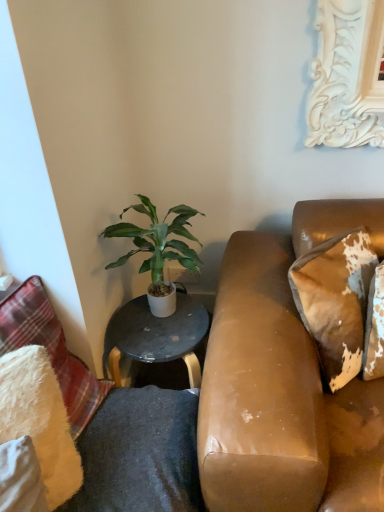
Question: Is the surface of leather-like brown pillow at right, placed as the third pillow when sorted from left to right, in direct contact with green leafy plant at center?

Choices:
 (A) yes
 (B) no

Answer: (B)

Question: Considering the relative sizes of leather-like brown pillow at right, placed as the third pillow when sorted from left to right, and green leafy plant at center in the image provided, is leather-like brown pillow at right, placed as the third pillow when sorted from left to right, smaller than green leafy plant at center?

Choices:
 (A) yes
 (B) no

Answer: (A)

Question: Can you confirm if leather-like brown pillow at right, the 1th pillow viewed from the right, is taller than green leafy plant at center?

Choices:
 (A) yes
 (B) no

Answer: (B)

Question: Is leather-like brown pillow at right, placed as the third pillow when sorted from left to right, facing towards green leafy plant at center?

Choices:
 (A) no
 (B) yes

Answer: (A)

Question: Is leather-like brown pillow at right, the 1th pillow viewed from the right, not inside green leafy plant at center?

Choices:
 (A) yes
 (B) no

Answer: (A)

Question: Is leather-like brown pillow at right, the 1th pillow viewed from the right, facing away from green leafy plant at center?

Choices:
 (A) yes
 (B) no

Answer: (B)

Question: Does fluffy white pillow at left, which is the third pillow from right to left, come behind green leafy plant at center?

Choices:
 (A) yes
 (B) no

Answer: (B)

Question: Is fluffy white pillow at left, the 1th pillow in the left-to-right sequence, to the right of green leafy plant at center from the viewer's perspective?

Choices:
 (A) no
 (B) yes

Answer: (A)

Question: Is fluffy white pillow at left, which is the third pillow from right to left, wider than green leafy plant at center?

Choices:
 (A) yes
 (B) no

Answer: (B)

Question: Could you tell me if fluffy white pillow at left, which is the third pillow from right to left, is turned towards green leafy plant at center?

Choices:
 (A) yes
 (B) no

Answer: (B)

Question: Does fluffy white pillow at left, which is the third pillow from right to left, appear on the left side of green leafy plant at center?

Choices:
 (A) no
 (B) yes

Answer: (B)

Question: From a real-world perspective, does fluffy white pillow at left, the 1th pillow in the left-to-right sequence, sit lower than green leafy plant at center?

Choices:
 (A) no
 (B) yes

Answer: (B)

Question: From a real-world perspective, is green leafy plant at center located higher than white fluffy pillow at lower left, placed as the 2th pillow when sorted from left to right?

Choices:
 (A) yes
 (B) no

Answer: (A)